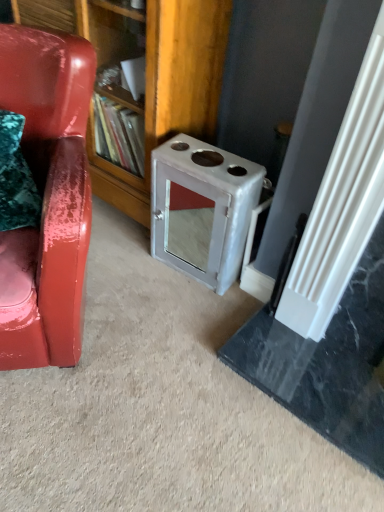
You are a GUI agent. You are given a task and a screenshot of the screen. Output one action in this format:
    pyautogui.click(x=<x>, y=<y>)
    Task: Click on the free area in between metallic gray stove at center-right and glossy leather chair at left
    
    Given the screenshot: What is the action you would take?
    pyautogui.click(x=139, y=298)